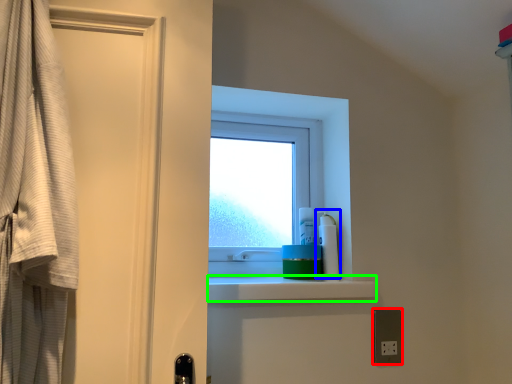
Question: Considering the real-world distances, which object is closest to electric outlet (highlighted by a red box)? cleaning product (highlighted by a blue box) or balustrade (highlighted by a green box).

Choices:
 (A) cleaning product
 (B) balustrade

Answer: (A)